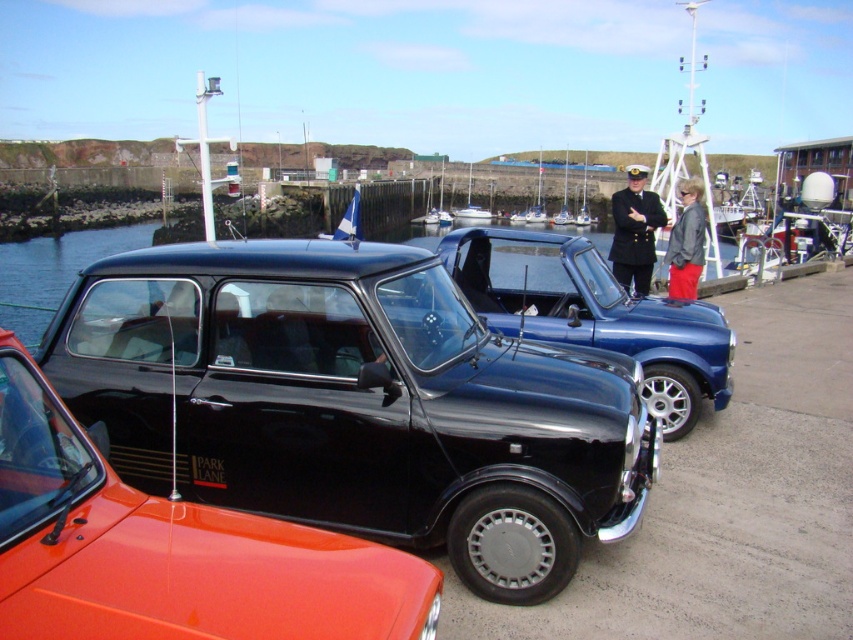
You are standing at the marina and want to reach a specific point marked at coordinates point (244, 564). If you can walk 2 meters in 1 minute, how long will it take you to reach that point?

The distance of point (244, 564) from viewer is 2.33 meters. Since you walk 2 meters per minute, it will take approximately 1.165 minutes, which is about 1 minute and 8 seconds to reach the point.

You are standing at the point with coordinates point (360,604) and want to walk towards the point with coordinates point (619,227). Which direction should you move relative to the vintage cars?

You should move towards the point (619,227) by walking away from the vintage cars since point (360,604) is in front of point (619,227). This means point (619,227) is behind the vintage cars from your current position.